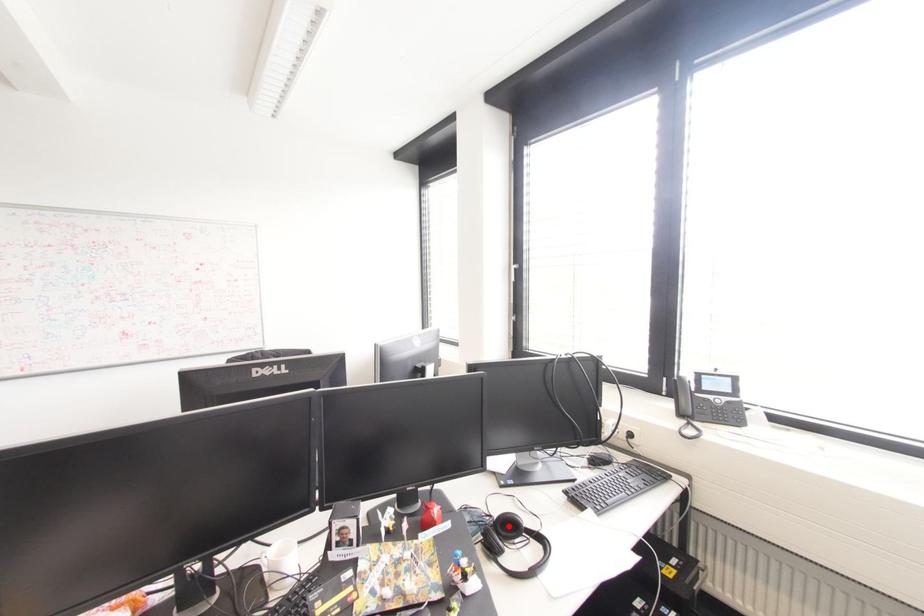
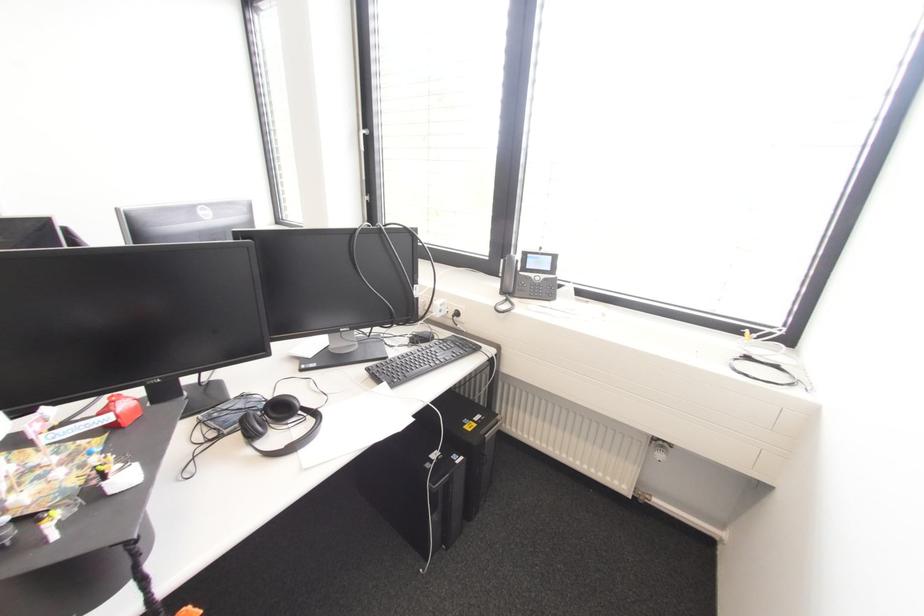
In the second image, find the point that corresponds to the highlighted location in the first image.

(281, 408)